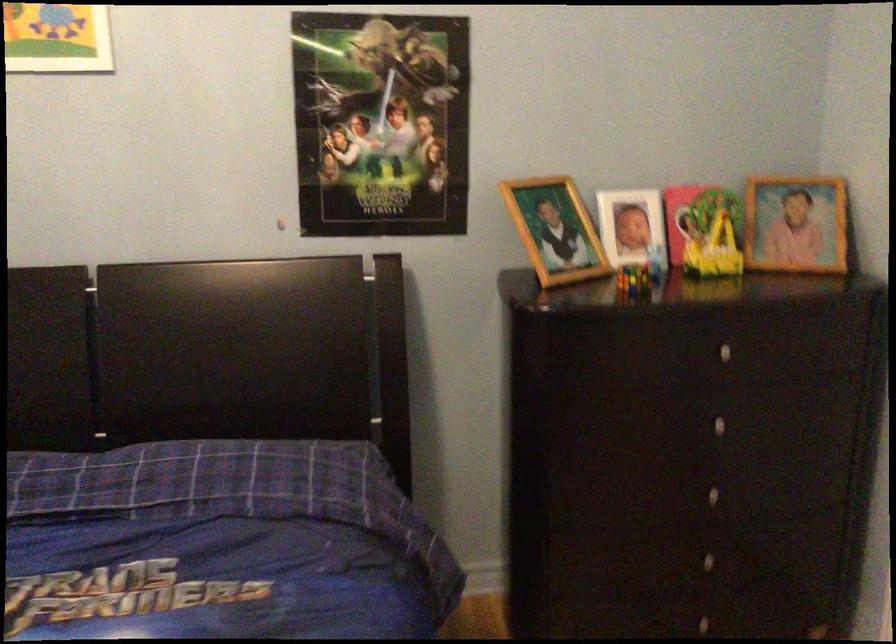
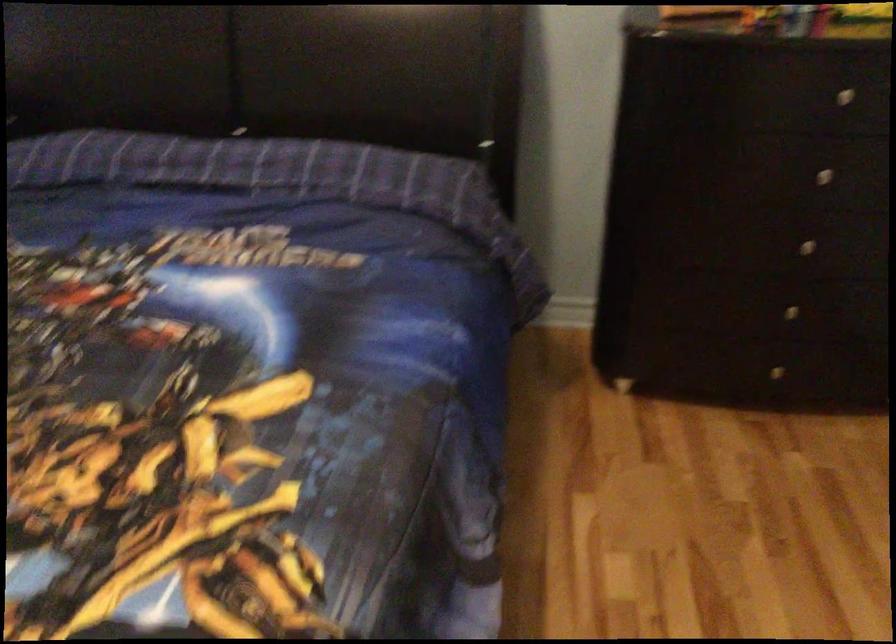
Find the pixel in the second image that matches (718,491) in the first image.

(805, 245)